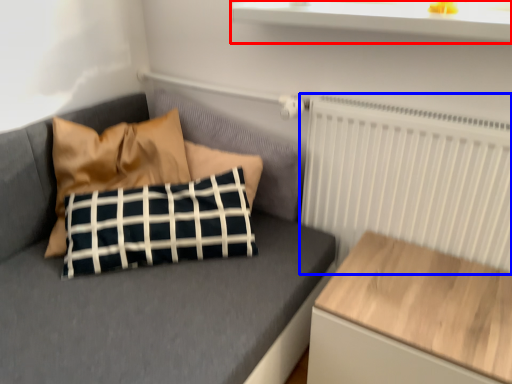
Question: Which of the following is the closest to the observer, window sill (highlighted by a red box) or radiator (highlighted by a blue box)?

Choices:
 (A) window sill
 (B) radiator

Answer: (A)